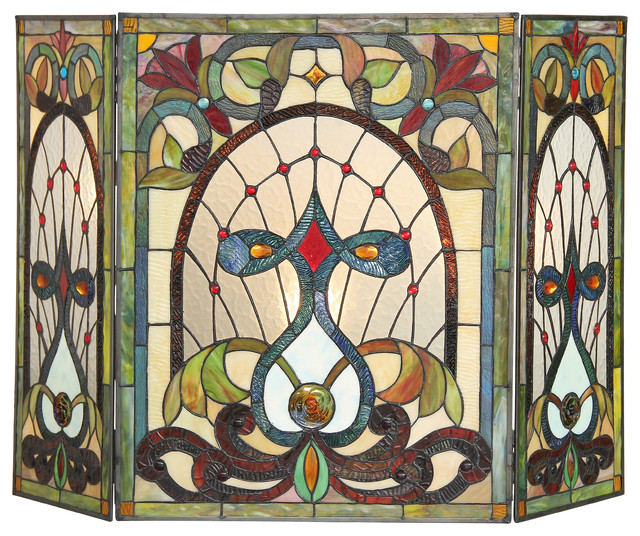
Where is `stained glass frame`? This screenshot has height=536, width=640. stained glass frame is located at coordinates (505, 518), (523, 517), (614, 492), (116, 515), (109, 515), (12, 492).